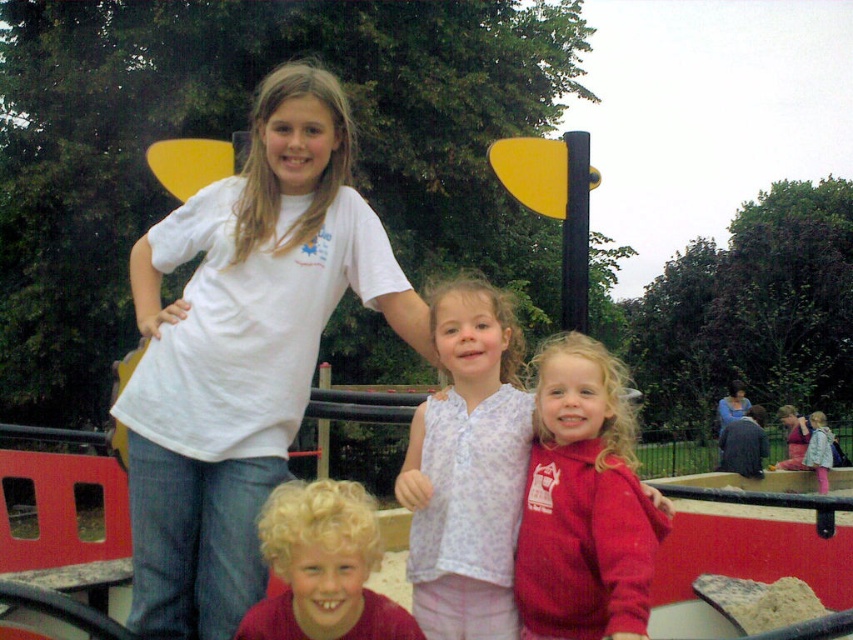
Question: Which point is closer to the camera?

Choices:
 (A) (664, 516)
 (B) (422, 504)
 (C) (408, 342)
 (D) (343, 596)

Answer: (D)

Question: Among these objects, which one is farthest from the camera?

Choices:
 (A) white matte t-shirt at upper left
 (B) curly blonde hair at center
 (C) light purple fabric shirt at center

Answer: (A)

Question: Is light purple fabric shirt at center above curly blonde hair at center?

Choices:
 (A) no
 (B) yes

Answer: (B)

Question: Does red fleece jacket at center have a smaller size compared to curly blonde hair at center?

Choices:
 (A) no
 (B) yes

Answer: (A)

Question: Does white matte t-shirt at upper left appear on the left side of curly blonde hair at center?

Choices:
 (A) yes
 (B) no

Answer: (A)

Question: Which object is positioned farthest from the light purple fabric shirt at center?

Choices:
 (A) white matte t-shirt at upper left
 (B) curly blonde hair at center
 (C) red fleece jacket at center

Answer: (A)